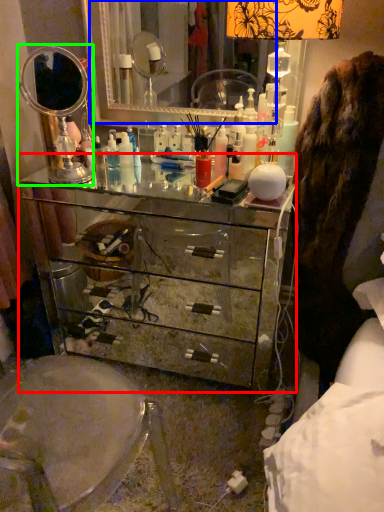
Question: Based on their relative distances, which object is farther from chest of drawers (highlighted by a red box)? Choose from mirror (highlighted by a blue box) and mirror (highlighted by a green box).

Choices:
 (A) mirror
 (B) mirror

Answer: (A)